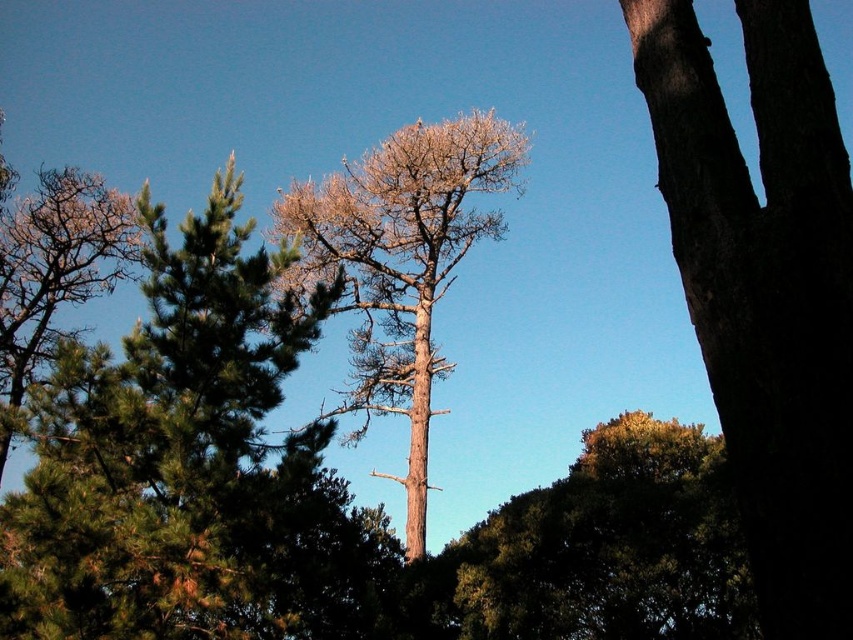
You are a bird looking for a nesting spot. You see the dark brown bark tree at right and the bare wood tree at center. Which tree is shorter and better for building a nest?

The dark brown bark tree at right is shorter than the bare wood tree at center, so it might be better for building a nest if you prefer a lower nesting spot.

You are an observer standing in the forest looking at the dark brown bark tree at right and the green leafy tree at center. Which tree is positioned closer to your left side?

The dark brown bark tree at right is to the left of the green leafy tree at center, so it is positioned closer to your left side.